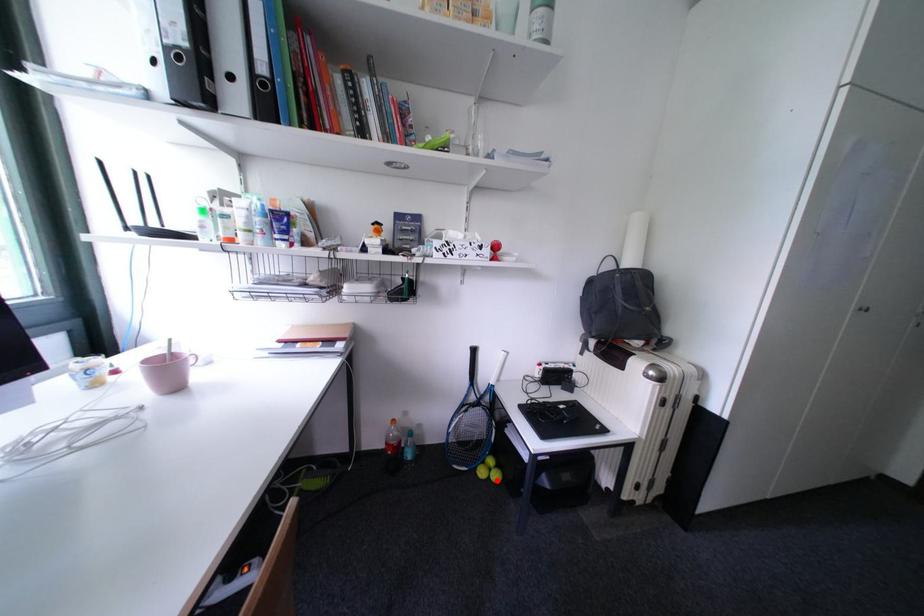
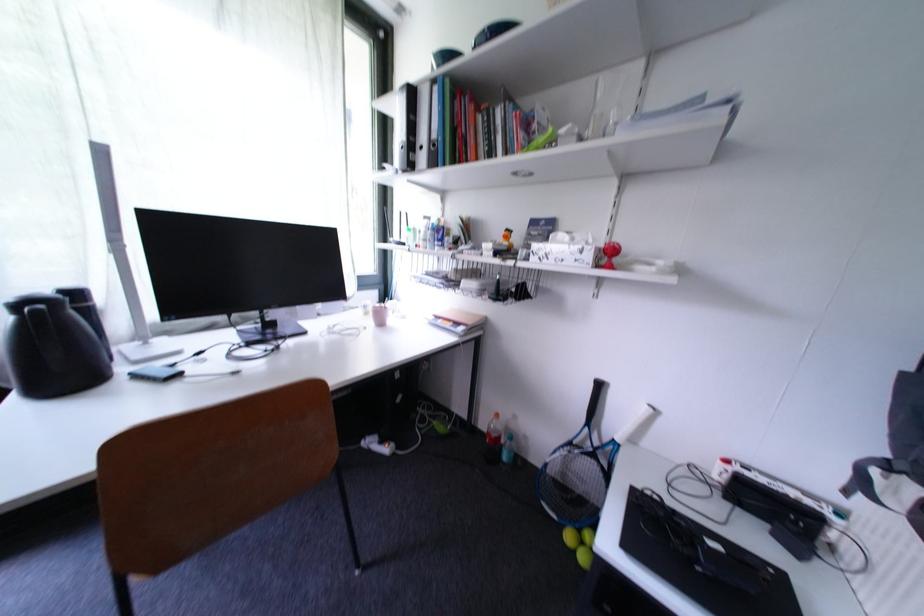
Locate, in the second image, the point that corresponds to the highlighted location in the first image.

(582, 554)